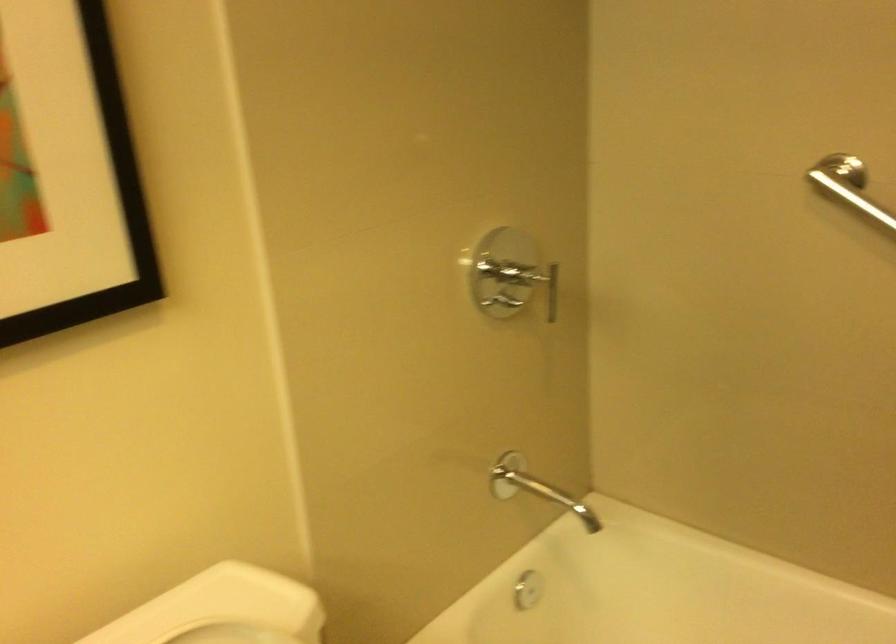
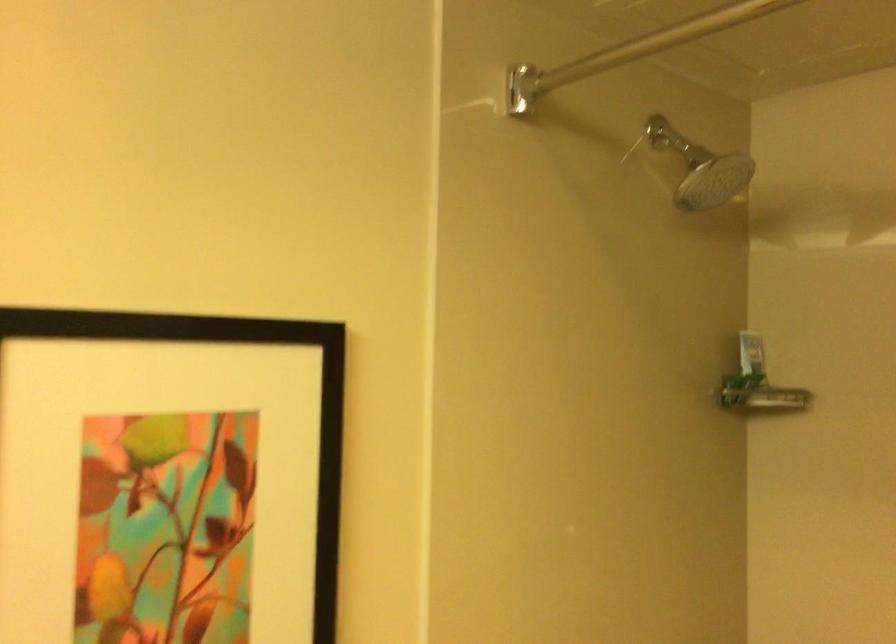
Which direction would the cameraman need to move to produce the second image?

The movement direction of the cameraman is left, backward.